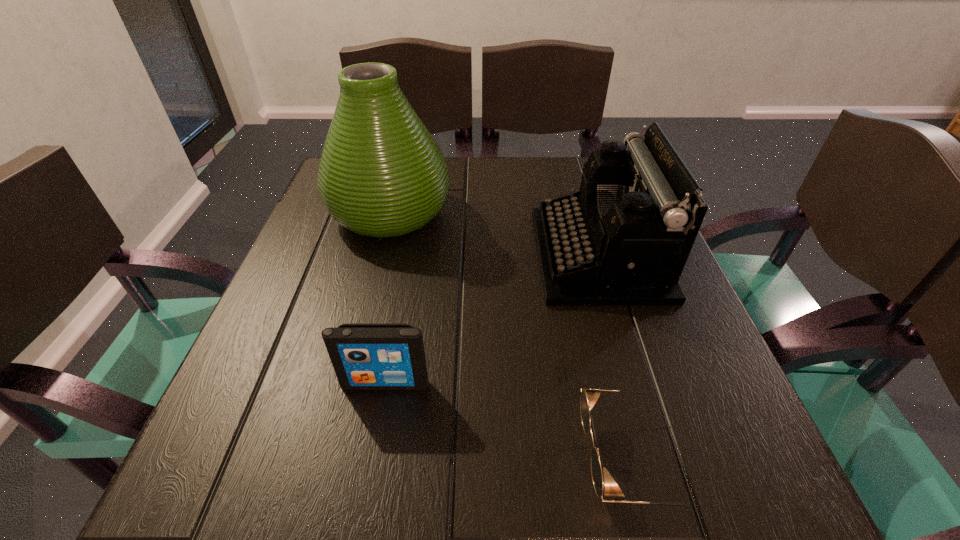
Identify the location of free space between the second tallest object and the shortest object. (616, 356).

Locate an element on the screen. free spot between the nearest object and the third farthest object is located at coordinates (509, 420).

Locate an element on the screen. The width and height of the screenshot is (960, 540). free space that is in between the typewriter and the third farthest object is located at coordinates (492, 319).

Where is `empty space that is in between the third tallest object and the nearest object`? empty space that is in between the third tallest object and the nearest object is located at coordinates (509, 420).

The width and height of the screenshot is (960, 540). I want to click on empty space between the iPod and the third shortest object, so click(x=492, y=319).

The width and height of the screenshot is (960, 540). What are the coordinates of `free space between the nearest object and the third shortest object` in the screenshot? It's located at (616, 356).

You are a GUI agent. You are given a task and a screenshot of the screen. Output one action in this format:
    pyautogui.click(x=<x>, y=<y>)
    Task: Click on the free space that is in between the third shortest object and the tallest object
    
    Given the screenshot: What is the action you would take?
    pyautogui.click(x=494, y=234)

Identify which object is the third nearest to the sunglasses. Please provide its 2D coordinates. Your answer should be formatted as a tuple, i.e. [(x, y)], where the tuple contains the x and y coordinates of a point satisfying the conditions above.

[(381, 174)]

Select which object appears as the closest to the second shortest object. Please provide its 2D coordinates. Your answer should be formatted as a tuple, i.e. [(x, y)], where the tuple contains the x and y coordinates of a point satisfying the conditions above.

[(589, 397)]

You are a GUI agent. You are given a task and a screenshot of the screen. Output one action in this format:
    pyautogui.click(x=<x>, y=<y>)
    Task: Click on the vacant space that satisfies the following two spatial constraints: 1. on the typing side of the typewriter; 2. on the front screen of the second shortest object
    
    Given the screenshot: What is the action you would take?
    pyautogui.click(x=637, y=383)